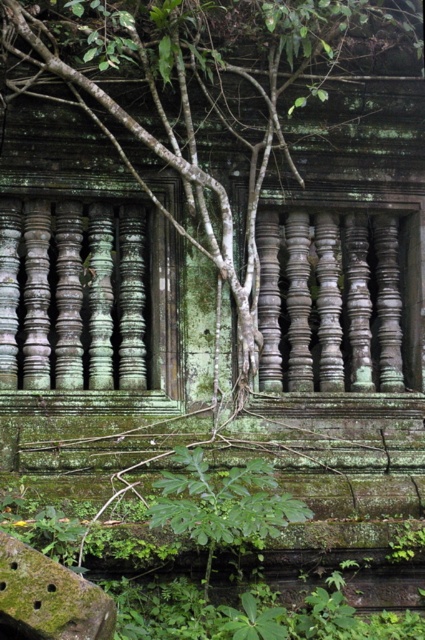
You are an archaeologist examining the ancient structure. You notice a point of interest at coordinates (201, 92). What object is located at this point?

The green mossy tree at center is located at point (201, 92).

You are standing in front of the ancient structure and want to touch both the green mossy tree at center and the green leafy plant at lower center. Which one should you reach for first?

You should reach for the green mossy tree at center first because it is closer to you than the green leafy plant at lower center.

You are an archaeologist examining the ancient structure. You notice the green mossy tree at center and the green leafy plant at lower center. Which of these two plants has a greater width?

The green mossy tree at center has a greater width than the green leafy plant at lower center.